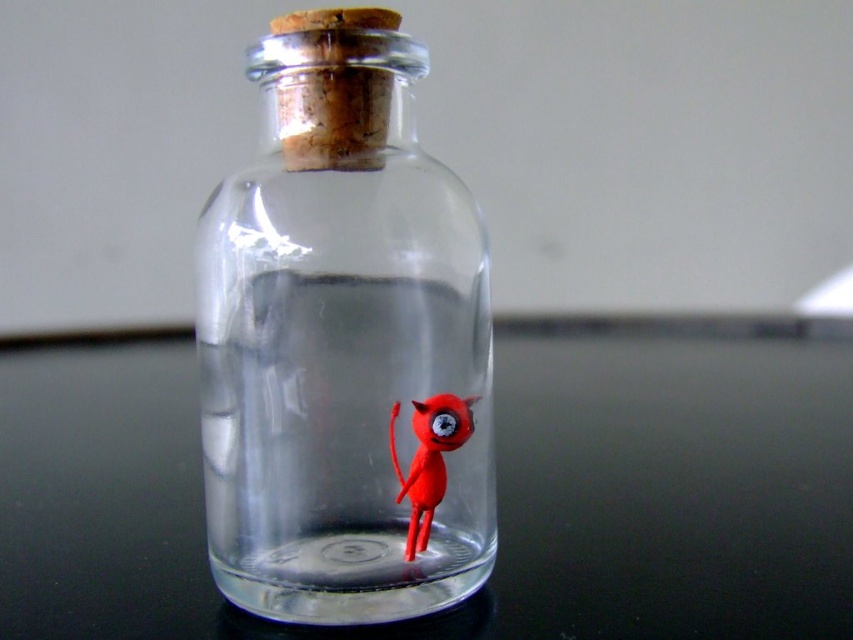
You are trying to place a small decorative item on the black glass table at center. However, you notice the transparent glass bottle at center is already occupying that space. Can you place the item on the table without moving the bottle?

The transparent glass bottle at center is taller than the black glass table at center, so the bottle is likely resting on the table. Since the bottle is already on the table, you can place the item next to the transparent glass bottle at center on the black glass table at center.

From the picture: You are a delivery person holding a package that is 24 inches long. You need to place it on the black glass table at center. Can you fit the package on the table without it hanging over the edge?

The black glass table at center and viewer are 24.49 inches apart. Since the package is 24 inches long, which is shorter than the distance between you and the table, the package can be placed on the table without hanging over the edge.

You are arranging items on a table and have a black glass table at center and a rubber matte toy at center. Which item is located to the right of the other?

The black glass table at center is positioned on the right side of the rubber matte toy at center.